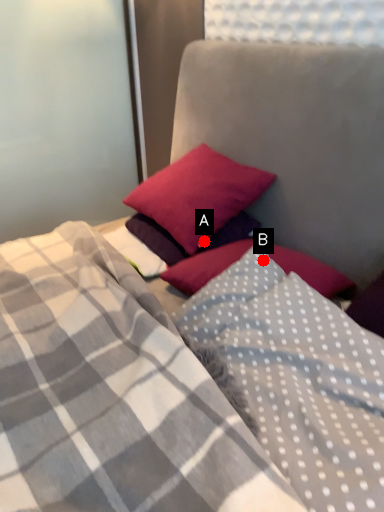
Question: Two points are circled on the image, labeled by A and B beside each circle. Which point is farther from the camera taking this photo?

Choices:
 (A) A is further
 (B) B is further

Answer: (A)